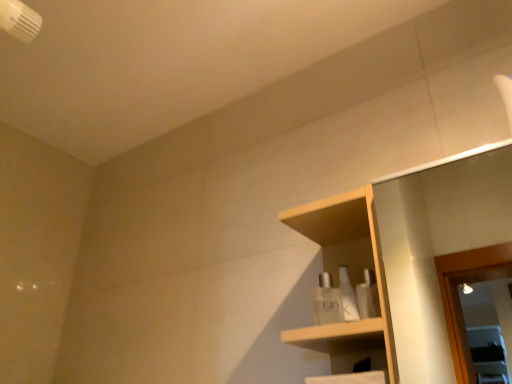
Image resolution: width=512 pixels, height=384 pixels. I want to click on white glossy bottles at center, which ranks as the 2th toiletry in back-to-front order, so click(x=335, y=299).

At what (x,y) coordinates should I click in order to perform the action: click on wooden shelf at center. Please return your answer as a coordinate pair (x, y). The height and width of the screenshot is (384, 512). Looking at the image, I should click on (350, 277).

Does wooden shelf at center touch white glossy bottles at center, which ranks as the 2th toiletry in back-to-front order?

Yes, wooden shelf at center is beside white glossy bottles at center, which ranks as the 2th toiletry in back-to-front order.

Which is more to the left, wooden shelf at center or white glossy bottles at center, acting as the first toiletry starting from the front?

Positioned to the left is white glossy bottles at center, acting as the first toiletry starting from the front.

Is wooden shelf at center taller than white glossy bottles at center, acting as the first toiletry starting from the front?

Correct, wooden shelf at center is much taller as white glossy bottles at center, acting as the first toiletry starting from the front.

What's the angular difference between wooden shelf at center and white glossy bottles at center, acting as the first toiletry starting from the front,'s facing directions?

The angle between the facing direction of wooden shelf at center and the facing direction of white glossy bottles at center, acting as the first toiletry starting from the front, is 40.8 degrees.

Is clear glass perfume at center, which appears as the second toiletry when viewed from the front, at the left side of wooden shelf at center?

Correct, you'll find clear glass perfume at center, which appears as the second toiletry when viewed from the front, to the left of wooden shelf at center.

The height and width of the screenshot is (384, 512). Find the location of `toiletry below the wooden shelf at center (from the image's perspective)`. toiletry below the wooden shelf at center (from the image's perspective) is located at coordinates (327, 301).

Are clear glass perfume at center, marked as the first toiletry in a back-to-front arrangement, and wooden shelf at center making contact?

Yes, clear glass perfume at center, marked as the first toiletry in a back-to-front arrangement, is next to wooden shelf at center.

Which of these two, clear glass perfume at center, marked as the first toiletry in a back-to-front arrangement, or wooden shelf at center, is thinner?

Thinner between the two is clear glass perfume at center, marked as the first toiletry in a back-to-front arrangement.

Is wooden shelf at center inside the boundaries of clear glass perfume at center, which appears as the second toiletry when viewed from the front, or outside?

wooden shelf at center is not enclosed by clear glass perfume at center, which appears as the second toiletry when viewed from the front.

From the image's perspective, does wooden shelf at center appear lower than clear glass perfume at center, which appears as the second toiletry when viewed from the front?

No, from the image's perspective, wooden shelf at center is not beneath clear glass perfume at center, which appears as the second toiletry when viewed from the front.

Which is closer to the camera, (365, 267) or (315, 305)?

Point (365, 267) is closer to the camera than point (315, 305).

From the picture: Is wooden shelf at center positioned before clear glass perfume at center, marked as the first toiletry in a back-to-front arrangement?

Yes, the depth of wooden shelf at center is less than that of clear glass perfume at center, marked as the first toiletry in a back-to-front arrangement.

Can you confirm if white glossy bottles at center, acting as the first toiletry starting from the front, is smaller than clear glass perfume at center, marked as the first toiletry in a back-to-front arrangement?

No.

How different are the orientations of white glossy bottles at center, acting as the first toiletry starting from the front, and clear glass perfume at center, marked as the first toiletry in a back-to-front arrangement, in degrees?

The angle between the facing direction of white glossy bottles at center, acting as the first toiletry starting from the front, and the facing direction of clear glass perfume at center, marked as the first toiletry in a back-to-front arrangement, is 19.1 degrees.

The height and width of the screenshot is (384, 512). I want to click on toiletry on the left of the white glossy bottles at center, acting as the first toiletry starting from the front, so click(327, 301).

Would you say white glossy bottles at center, acting as the first toiletry starting from the front, is to the left or to the right of clear glass perfume at center, marked as the first toiletry in a back-to-front arrangement, in the picture?

white glossy bottles at center, acting as the first toiletry starting from the front, is to the right of clear glass perfume at center, marked as the first toiletry in a back-to-front arrangement.

Is point (335, 302) positioned after point (332, 306)?

That is True.

Is clear glass perfume at center, which appears as the second toiletry when viewed from the front, at the left side of white glossy bottles at center, acting as the first toiletry starting from the front?

Indeed, clear glass perfume at center, which appears as the second toiletry when viewed from the front, is positioned on the left side of white glossy bottles at center, acting as the first toiletry starting from the front.

Is clear glass perfume at center, marked as the first toiletry in a back-to-front arrangement, facing away from white glossy bottles at center, which ranks as the 2th toiletry in back-to-front order?

No, clear glass perfume at center, marked as the first toiletry in a back-to-front arrangement,'s orientation is not away from white glossy bottles at center, which ranks as the 2th toiletry in back-to-front order.

Is white glossy bottles at center, which ranks as the 2th toiletry in back-to-front order, positioned with its back to wooden shelf at center?

Correct, white glossy bottles at center, which ranks as the 2th toiletry in back-to-front order, is looking away from wooden shelf at center.

Does white glossy bottles at center, acting as the first toiletry starting from the front, come behind wooden shelf at center?

That is True.

Considering the relative sizes of white glossy bottles at center, acting as the first toiletry starting from the front, and wooden shelf at center in the image provided, is white glossy bottles at center, acting as the first toiletry starting from the front, smaller than wooden shelf at center?

Yes, white glossy bottles at center, acting as the first toiletry starting from the front, is smaller than wooden shelf at center.

Identify the location of shelf on the right of the white glossy bottles at center, acting as the first toiletry starting from the front. (350, 277).

The image size is (512, 384). In order to click on shelf above the clear glass perfume at center, which appears as the second toiletry when viewed from the front (from the image's perspective) in this screenshot , I will do `click(350, 277)`.

Based on their spatial positions, is wooden shelf at center or clear glass perfume at center, which appears as the second toiletry when viewed from the front, further from white glossy bottles at center, which ranks as the 2th toiletry in back-to-front order?

wooden shelf at center lies further to white glossy bottles at center, which ranks as the 2th toiletry in back-to-front order, than the other object.

When comparing their distances from clear glass perfume at center, which appears as the second toiletry when viewed from the front, does wooden shelf at center or white glossy bottles at center, which ranks as the 2th toiletry in back-to-front order, seem closer?

The object closer to clear glass perfume at center, which appears as the second toiletry when viewed from the front, is white glossy bottles at center, which ranks as the 2th toiletry in back-to-front order.

Looking at the image, which one is located further to white glossy bottles at center, which ranks as the 2th toiletry in back-to-front order, clear glass perfume at center, which appears as the second toiletry when viewed from the front, or wooden shelf at center?

wooden shelf at center.

Looking at the image, which one is located closer to clear glass perfume at center, which appears as the second toiletry when viewed from the front, white glossy bottles at center, which ranks as the 2th toiletry in back-to-front order, or wooden shelf at center?

white glossy bottles at center, which ranks as the 2th toiletry in back-to-front order, is positioned closer to the anchor clear glass perfume at center, which appears as the second toiletry when viewed from the front.

When comparing their distances from wooden shelf at center, does clear glass perfume at center, which appears as the second toiletry when viewed from the front, or white glossy bottles at center, which ranks as the 2th toiletry in back-to-front order, seem further?

clear glass perfume at center, which appears as the second toiletry when viewed from the front, is positioned further to the anchor wooden shelf at center.

Which object lies further to the anchor point wooden shelf at center, white glossy bottles at center, acting as the first toiletry starting from the front, or clear glass perfume at center, marked as the first toiletry in a back-to-front arrangement?

clear glass perfume at center, marked as the first toiletry in a back-to-front arrangement, is further to wooden shelf at center.

Identify the location of toiletry positioned between wooden shelf at center and clear glass perfume at center, which appears as the second toiletry when viewed from the front, from near to far. The height and width of the screenshot is (384, 512). (335, 299).